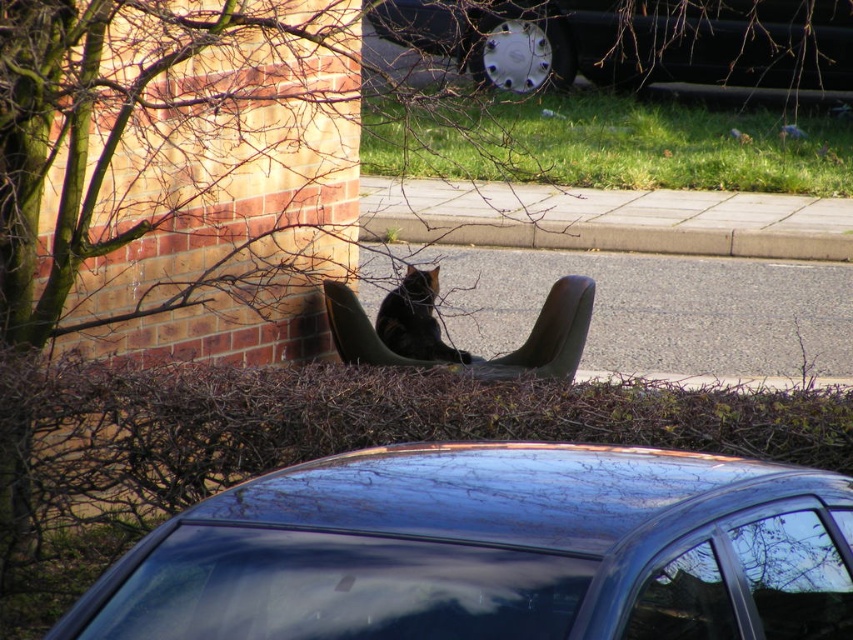
Does glossy metallic car at center have a lesser width compared to shiny black car at center?

Yes, glossy metallic car at center is thinner than shiny black car at center.

Who is lower down, glossy metallic car at center or shiny black car at center?

glossy metallic car at center is below.

Who is more distant from viewer, (560, 531) or (740, 0)?

The point (740, 0) is behind.

Locate an element on the screen. The height and width of the screenshot is (640, 853). glossy metallic car at center is located at coordinates (492, 550).

Between point (396, 577) and point (399, 333), which one is positioned in front?

Positioned in front is point (396, 577).

Does glossy metallic car at center have a greater width compared to black fur cat at center?

Yes, glossy metallic car at center is wider than black fur cat at center.

Which is in front, point (722, 544) or point (416, 307)?

Point (722, 544)

At what (x,y) coordinates should I click in order to perform the action: click on glossy metallic car at center. Please return your answer as a coordinate pair (x, y). Looking at the image, I should click on (492, 550).

Is shiny black car at center wider than black fur cat at center?

Correct, the width of shiny black car at center exceeds that of black fur cat at center.

Does shiny black car at center appear over black fur cat at center?

Yes.

Find the location of a particular element. The height and width of the screenshot is (640, 853). shiny black car at center is located at coordinates (630, 40).